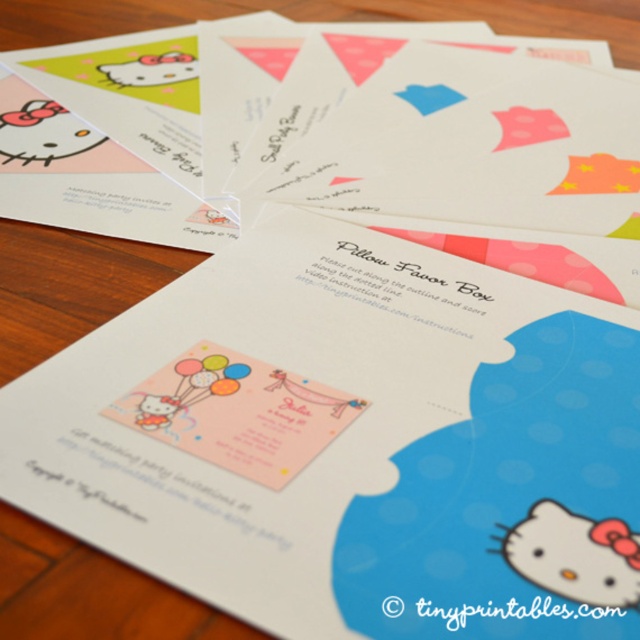
Which is in front, point (552, 337) or point (580, 516)?

Point (580, 516) is in front.

Is matte paper invitation at center wider than matte pink hello kitty at lower right?

Yes, matte paper invitation at center is wider than matte pink hello kitty at lower right.

The width and height of the screenshot is (640, 640). What do you see at coordinates (348, 440) in the screenshot? I see `matte paper invitation at center` at bounding box center [348, 440].

Where is `matte paper invitation at center`? The image size is (640, 640). matte paper invitation at center is located at coordinates (348, 440).

Which is behind, point (358, 317) or point (340, 406)?

Point (358, 317)

Who is higher up, matte paper invitation at center or pink paper card at center?

matte paper invitation at center is higher up.

Who is more forward, (x=157, y=442) or (x=336, y=419)?

Positioned in front is point (x=157, y=442).

Locate an element on the screen. matte paper invitation at center is located at coordinates (348, 440).

Can you confirm if pink paper card at center is shorter than matte pink hello kitty at lower right?

No.

Between pink paper card at center and matte pink hello kitty at lower right, which one is positioned higher?

pink paper card at center is above.

Between point (195, 394) and point (524, 524), which one is positioned behind?

Point (195, 394)

Image resolution: width=640 pixels, height=640 pixels. Identify the location of pink paper card at center. (237, 413).